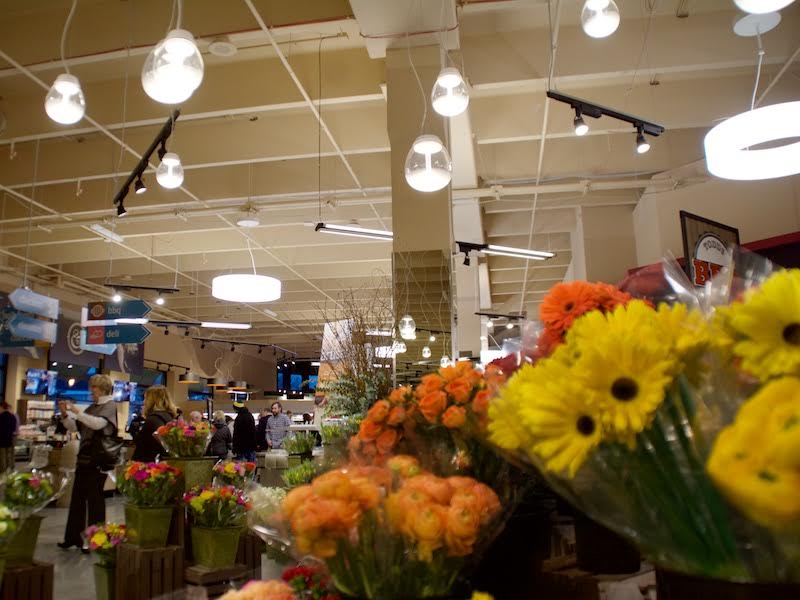
This screenshot has height=600, width=800. What are the coordinates of `floor` in the screenshot? It's located at (72, 584).